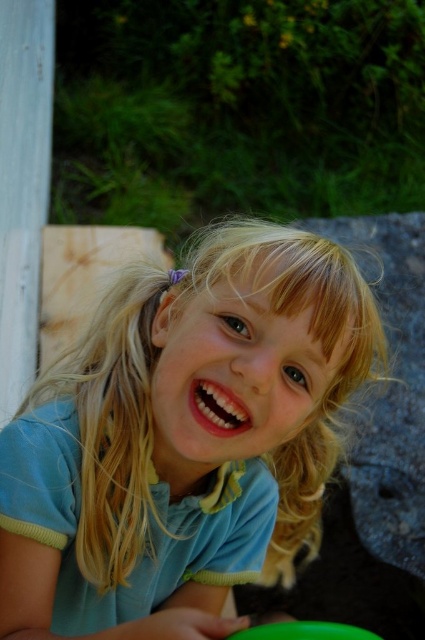
Question: Does blue cotton shirt at center have a larger size compared to green plastic frisbee at lower center?

Choices:
 (A) no
 (B) yes

Answer: (B)

Question: Which object appears farthest from the camera in this image?

Choices:
 (A) blue cotton shirt at center
 (B) green plastic frisbee at lower center

Answer: (A)

Question: Is blue cotton shirt at center thinner than green plastic frisbee at lower center?

Choices:
 (A) yes
 (B) no

Answer: (B)

Question: Which of the following is the closest to the observer?

Choices:
 (A) green plastic frisbee at lower center
 (B) blue cotton shirt at center

Answer: (A)

Question: Is blue cotton shirt at center thinner than green plastic frisbee at lower center?

Choices:
 (A) no
 (B) yes

Answer: (A)